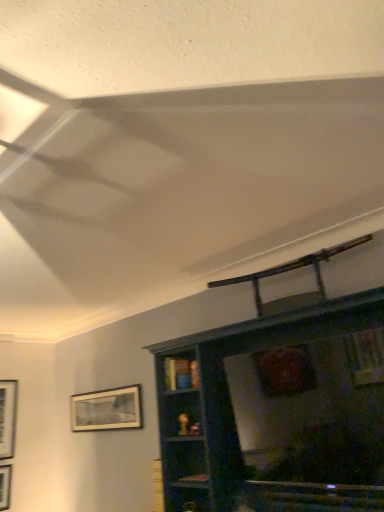
Question: Is matte black picture frame at lower left, which is counted as the first picture frame, starting from the right, a part of metallic silver swivel chair at upper center?

Choices:
 (A) no
 (B) yes

Answer: (A)

Question: Is metallic silver swivel chair at upper center thinner than matte black picture frame at lower left, which is counted as the first picture frame, starting from the right?

Choices:
 (A) no
 (B) yes

Answer: (A)

Question: Is metallic silver swivel chair at upper center positioned with its back to matte black picture frame at lower left, which is counted as the 2th picture frame, starting from the left?

Choices:
 (A) yes
 (B) no

Answer: (B)

Question: From a real-world perspective, is metallic silver swivel chair at upper center positioned under matte black picture frame at lower left, which is counted as the first picture frame, starting from the right, based on gravity?

Choices:
 (A) no
 (B) yes

Answer: (A)

Question: From the image's perspective, is metallic silver swivel chair at upper center beneath matte black picture frame at lower left, which is counted as the first picture frame, starting from the right?

Choices:
 (A) yes
 (B) no

Answer: (B)

Question: Is metallic silver swivel chair at upper center oriented towards matte black picture frame at lower left, which is counted as the 2th picture frame, starting from the left?

Choices:
 (A) no
 (B) yes

Answer: (A)

Question: Does dark wood shelf at upper center have a lesser width compared to matte black picture frame at lower left, which is counted as the 2th picture frame, starting from the left?

Choices:
 (A) no
 (B) yes

Answer: (A)

Question: Does dark wood shelf at upper center lie in front of matte black picture frame at lower left, which is counted as the first picture frame, starting from the right?

Choices:
 (A) yes
 (B) no

Answer: (A)

Question: Is dark wood shelf at upper center bigger than matte black picture frame at lower left, which is counted as the 2th picture frame, starting from the left?

Choices:
 (A) no
 (B) yes

Answer: (B)

Question: Is dark wood shelf at upper center smaller than matte black picture frame at lower left, which is counted as the 2th picture frame, starting from the left?

Choices:
 (A) no
 (B) yes

Answer: (A)

Question: Is dark wood shelf at upper center further to the viewer compared to matte black picture frame at lower left, which is counted as the first picture frame, starting from the right?

Choices:
 (A) no
 (B) yes

Answer: (A)

Question: Can you confirm if dark wood shelf at upper center is taller than matte black picture frame at lower left, which is counted as the first picture frame, starting from the right?

Choices:
 (A) no
 (B) yes

Answer: (B)

Question: Considering the relative positions of matte black picture frame at lower left, which is counted as the first picture frame, starting from the right, and dark wood shelf at upper center in the image provided, is matte black picture frame at lower left, which is counted as the first picture frame, starting from the right, in front of dark wood shelf at upper center?

Choices:
 (A) no
 (B) yes

Answer: (A)